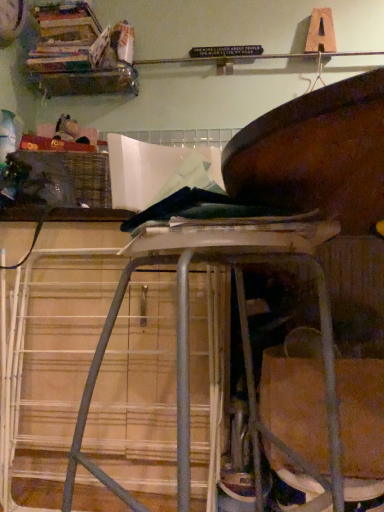
Question: From the image's perspective, is woven plastic crate at left above or below metal stool at center?

Choices:
 (A) above
 (B) below

Answer: (A)

Question: Is point (34, 200) closer or farther from the camera than point (235, 169)?

Choices:
 (A) closer
 (B) farther

Answer: (B)

Question: Based on their relative distances, which object is farther from the wooden books at upper left?

Choices:
 (A) woven plastic crate at left
 (B) metal stool at center

Answer: (B)

Question: Considering the real-world distances, which object is farthest from the woven plastic crate at left?

Choices:
 (A) metal stool at center
 (B) wooden books at upper left

Answer: (A)